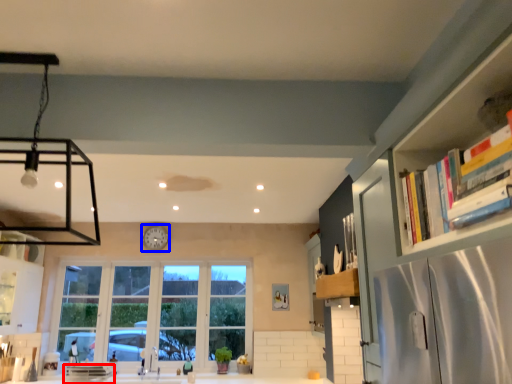
Question: Among these objects, which one is nearest to the camera, appliance (highlighted by a red box) or clock (highlighted by a blue box)?

Choices:
 (A) appliance
 (B) clock

Answer: (A)